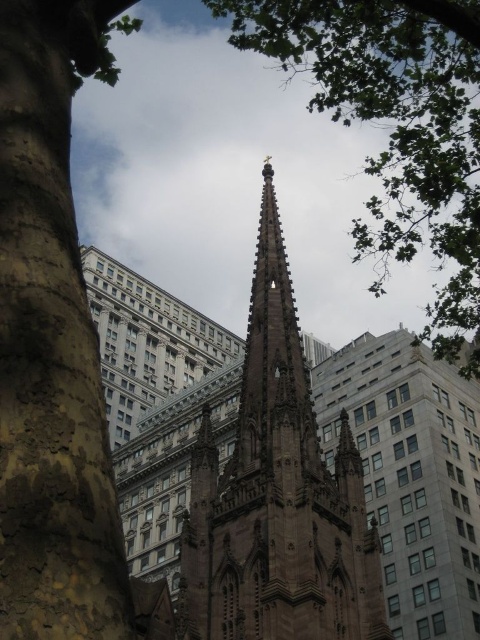
Who is positioned more to the right, brown rough bark at left or brown stone spire at center?

Positioned to the right is brown stone spire at center.

How distant is brown rough bark at left from brown stone spire at center?

brown rough bark at left and brown stone spire at center are 30.61 meters apart.

Does point (12, 122) come behind point (273, 216)?

No, it is in front of (273, 216).

Image resolution: width=480 pixels, height=640 pixels. In order to click on brown rough bark at left in this screenshot , I will do `click(51, 342)`.

Between brown stone spire at center and green leafy tree at upper center, which one is positioned higher?

Positioned higher is green leafy tree at upper center.

Is brown stone spire at center closer to camera compared to green leafy tree at upper center?

No, brown stone spire at center is further to the viewer.

This screenshot has width=480, height=640. Find the location of `brown stone spire at center`. brown stone spire at center is located at coordinates (276, 493).

Does brown rough bark at left appear under green leafy tree at upper center?

Correct, brown rough bark at left is located below green leafy tree at upper center.

Can you confirm if brown rough bark at left is bigger than green leafy tree at upper center?

Actually, brown rough bark at left might be smaller than green leafy tree at upper center.

Between point (56, 589) and point (344, 19), which one is positioned in front?

Point (56, 589)

At what (x,y) coordinates should I click in order to perform the action: click on brown rough bark at left. Please return your answer as a coordinate pair (x, y). The image size is (480, 640). Looking at the image, I should click on (51, 342).